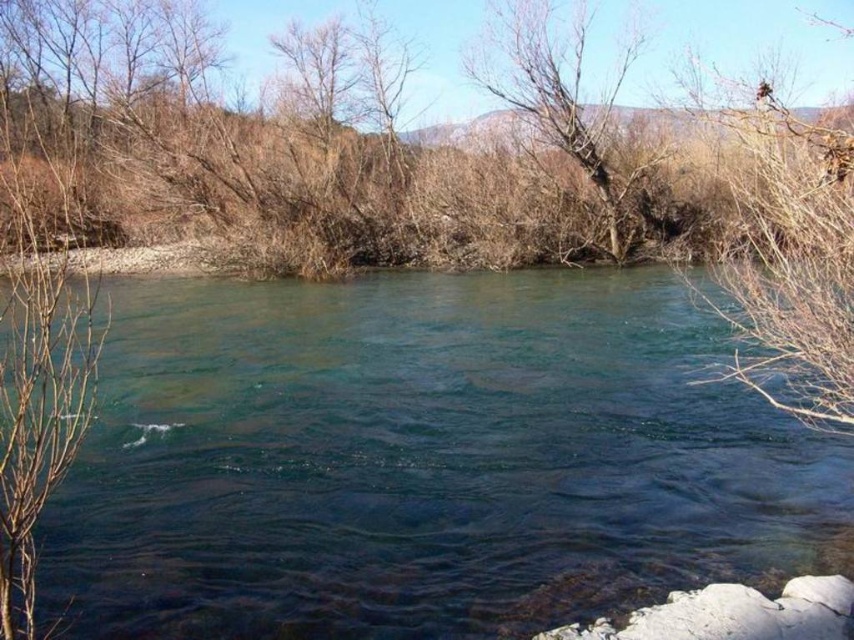
Question: Which of the following is the closest to the observer?

Choices:
 (A) click(534, 28)
 (B) click(247, 282)

Answer: (B)

Question: Does clear water at center appear over bare branches at center?

Choices:
 (A) no
 (B) yes

Answer: (A)

Question: Considering the real-world distances, which object is farthest from the clear water at center?

Choices:
 (A) bare branches at upper right
 (B) bare branches at center

Answer: (B)

Question: Does clear water at center lie in front of bare branches at center?

Choices:
 (A) no
 (B) yes

Answer: (B)

Question: Which of these objects is positioned closest to the bare branches at upper right?

Choices:
 (A) bare branches at center
 (B) clear water at center

Answer: (B)

Question: Does clear water at center have a lesser width compared to bare branches at upper right?

Choices:
 (A) no
 (B) yes

Answer: (B)